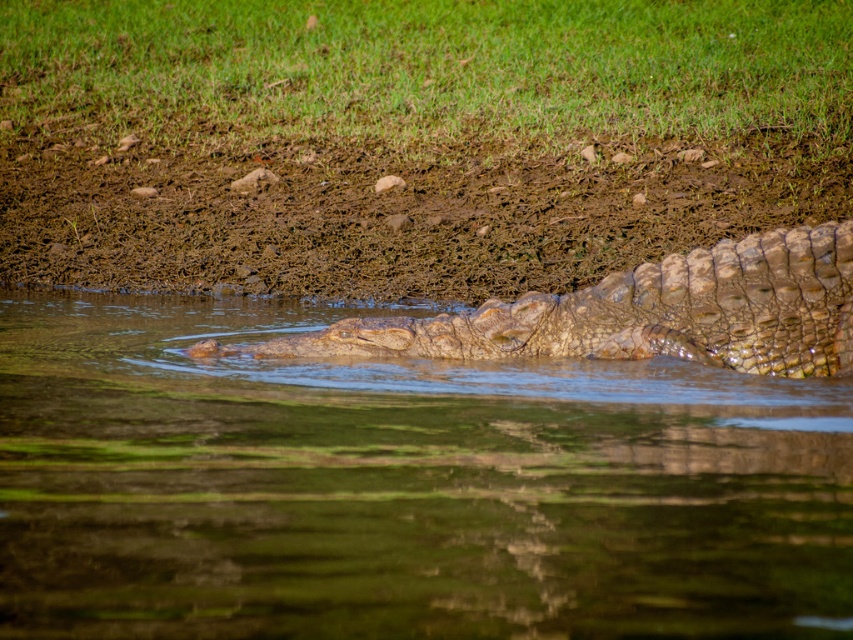
You are standing at the edge of the water and see the point labeled as point (401, 486). Is this point located on the greenish water at center?

Yes, the point (401, 486) is on the greenish water at center.

Consider the image. You are a photographer trying to capture the crocodile without disturbing it. You are standing on the brown textured mud at center. Can you see the leathery brown crocodile at center from your position?

The leathery brown crocodile at center is behind the brown textured mud at center, so you cannot see it from your current position on the brown textured mud at center.

You are standing in the scene and want to reach the point that is closer to you. Which point should you head towards, point (x=689, y=413) or point (x=300, y=348)?

You should head towards point (x=689, y=413) because it is closer to the viewer than point (x=300, y=348).